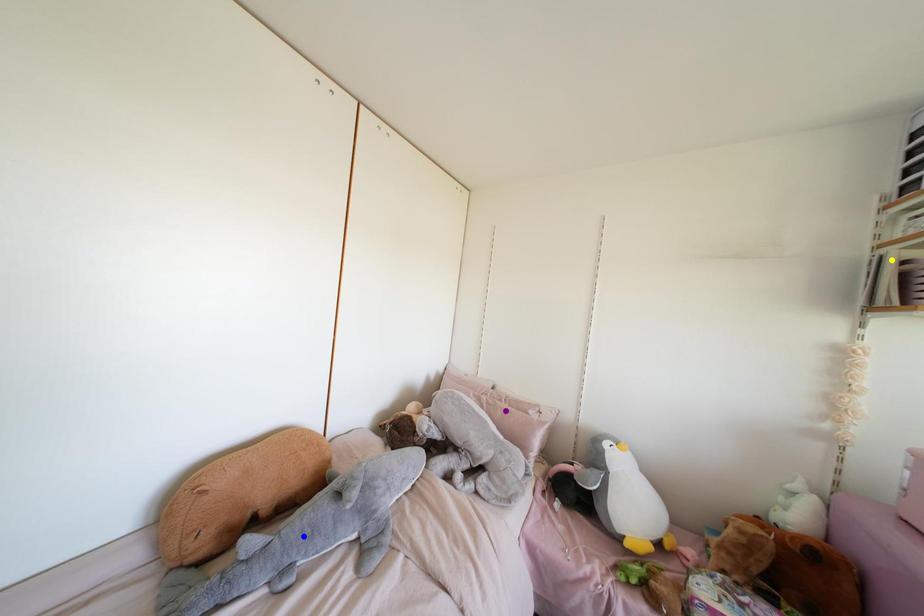
Order these from farthest to nearest:
A) yellow point
B) blue point
C) purple point

purple point → blue point → yellow point